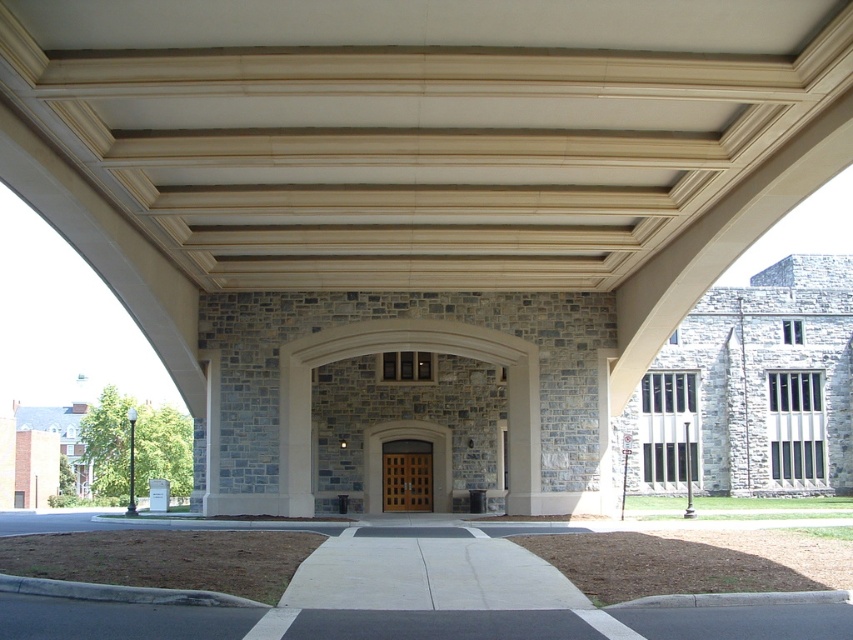
Question: Is wooden door at center to the left of brown wooden door at center from the viewer's perspective?

Choices:
 (A) yes
 (B) no

Answer: (B)

Question: Can you confirm if wooden door at center is thinner than brown wooden door at center?

Choices:
 (A) yes
 (B) no

Answer: (B)

Question: Which object appears farthest from the camera in this image?

Choices:
 (A) brown wooden door at center
 (B) wooden door at center

Answer: (A)

Question: Which point is closer to the camera taking this photo?

Choices:
 (A) (416, 438)
 (B) (413, 461)

Answer: (A)

Question: Can you confirm if wooden door at center is smaller than brown wooden door at center?

Choices:
 (A) no
 (B) yes

Answer: (A)